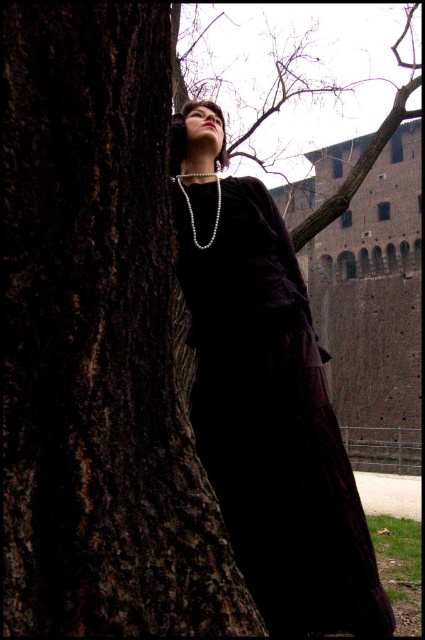
Question: Can you confirm if dark brown rough tree trunk at left is positioned to the left of velvet dark dress at center?

Choices:
 (A) yes
 (B) no

Answer: (A)

Question: Which point is closer to the camera taking this photo?

Choices:
 (A) (142, 132)
 (B) (308, 333)

Answer: (A)

Question: Is dark brown rough tree trunk at left closer to camera compared to velvet dark dress at center?

Choices:
 (A) yes
 (B) no

Answer: (A)

Question: Which point is closer to the camera?

Choices:
 (A) dark brown rough tree trunk at left
 (B) velvet dark dress at center

Answer: (A)

Question: Is dark brown rough tree trunk at left above velvet dark dress at center?

Choices:
 (A) yes
 (B) no

Answer: (A)